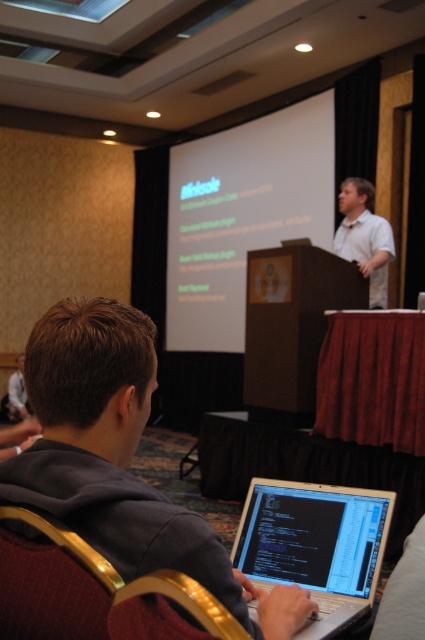
Question: Which point is farther from the camera taking this photo?

Choices:
 (A) (119, 355)
 (B) (388, 499)
 (C) (385, 225)

Answer: (C)

Question: Which point is closer to the camera?

Choices:
 (A) (283, 560)
 (B) (376, 257)
 (C) (156, 502)

Answer: (C)

Question: In this image, where is white matte projection screen at upper center located relative to silver metallic laptop at center?

Choices:
 (A) left
 (B) right

Answer: (A)

Question: Which point is farther to the camera?

Choices:
 (A) silver metallic laptop at center
 (B) white matte projection screen at upper center
 (C) gray hoodie at lower left
 (D) white shirt at center

Answer: (B)

Question: Considering the relative positions of gray hoodie at lower left and white shirt at center in the image provided, where is gray hoodie at lower left located with respect to white shirt at center?

Choices:
 (A) right
 (B) left

Answer: (B)

Question: Is gray hoodie at lower left above white shirt at center?

Choices:
 (A) yes
 (B) no

Answer: (B)